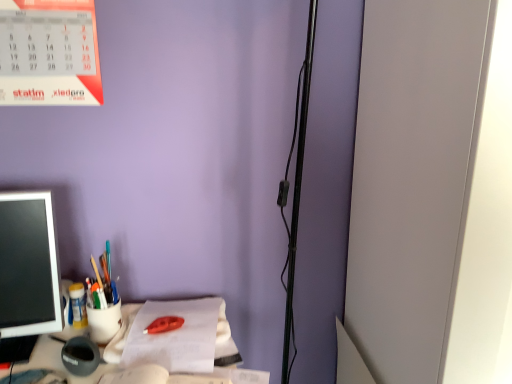
Question: From their relative heights in the image, would you say matte plastic cup at left, the fourth stationery when ordered from front to back, is taller or shorter than matte plastic pen holder at left?

Choices:
 (A) tall
 (B) short

Answer: (B)

Question: From the image's perspective, is matte plastic cup at left, the fourth stationery when ordered from front to back, positioned above or below matte plastic pen holder at left?

Choices:
 (A) below
 (B) above

Answer: (A)

Question: Which is farther from the matte plastic pen holder at left, the 2th stationery when ordered from back to front?

Choices:
 (A) matte plastic pen holder at left
 (B) matte plastic cup at left, the fourth stationery when ordered from front to back
 (C) matte plastic cup at left, which ranks as the 2th stationery in front-to-back order
 (D) white paper at center
 (E) matte black mouse at lower left, the first stationery viewed from the front

Answer: (A)

Question: Which object is positioned farthest from the matte plastic cup at left, placed as the first stationery when sorted from back to front?

Choices:
 (A) white paper at center
 (B) matte plastic pen holder at left, the 2th stationery when ordered from back to front
 (C) matte black mouse at lower left, acting as the 4th stationery starting from the back
 (D) matte plastic pen holder at left
 (E) matte plastic cup at left, which ranks as the 2th stationery in front-to-back order

Answer: (A)